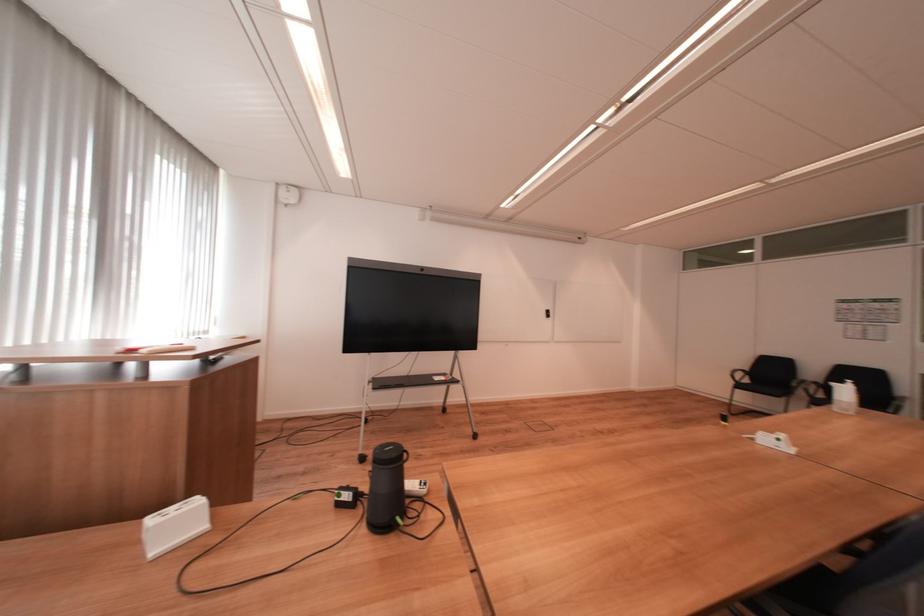
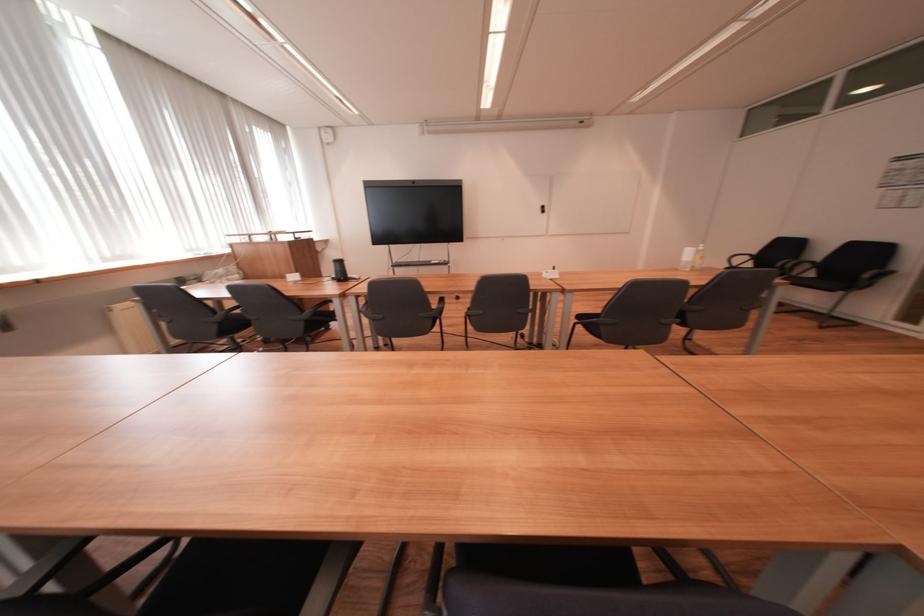
The point at [355,498] is marked in the first image. Where is the corresponding point in the second image?

(343, 278)